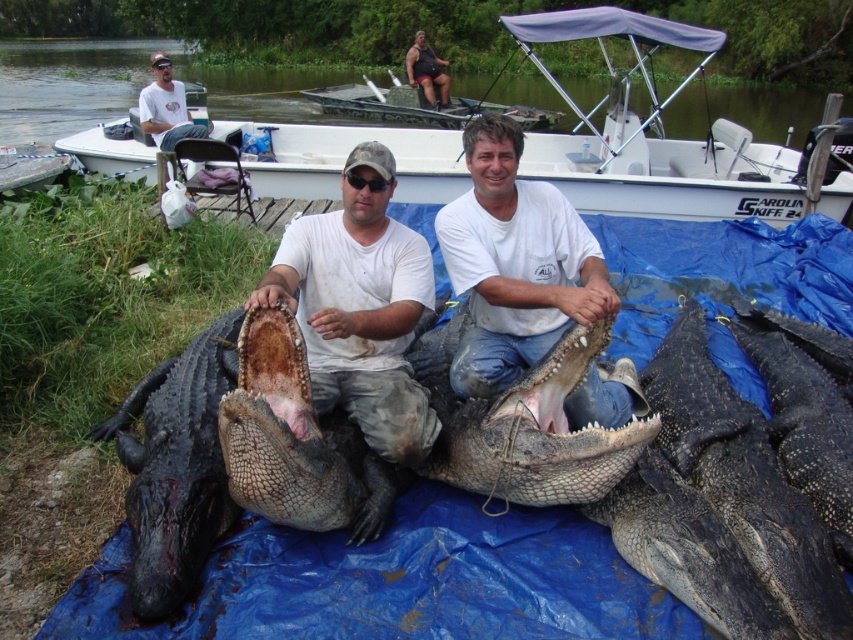
You are a photographer trying to capture a clear photo of the shiny black crocodile at center. However, the matte white shirt at center is blocking your view. Can you adjust your position to see the crocodile without the shirt blocking it?

The shiny black crocodile at center is in front of the matte white shirt at center, so you can move your position slightly to the side to see the crocodile without the shirt blocking it.

Based on the scene description, can you determine which object is taller between the matte white shirt at center and the rough textured alligator at center?

The matte white shirt at center is much taller than the rough textured alligator at center according to the description.